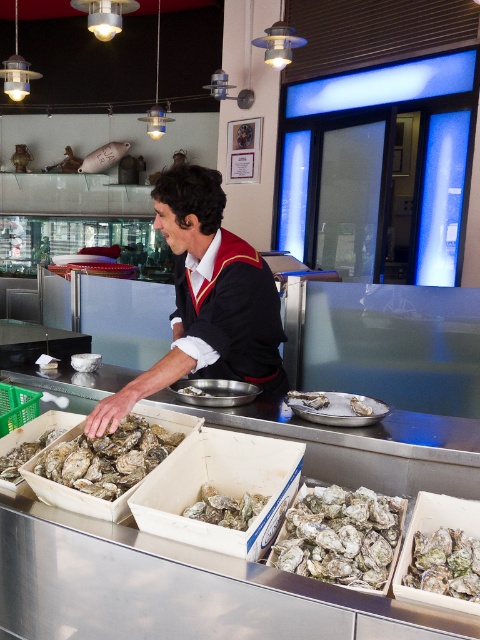
You are a customer at the seafood counter and want to compare the size of the black fabric shirt at center and the white matte oyster at center. Which one is bigger?

The black fabric shirt at center is larger in size compared to the white matte oyster at center.

Based on the photo, you are standing at the entrance of the seafood market and see a shiny gray oyster at center. Where is the point located at coordinate (342, 536)?

The point at coordinate (342, 536) is located on the shiny gray oyster at center.